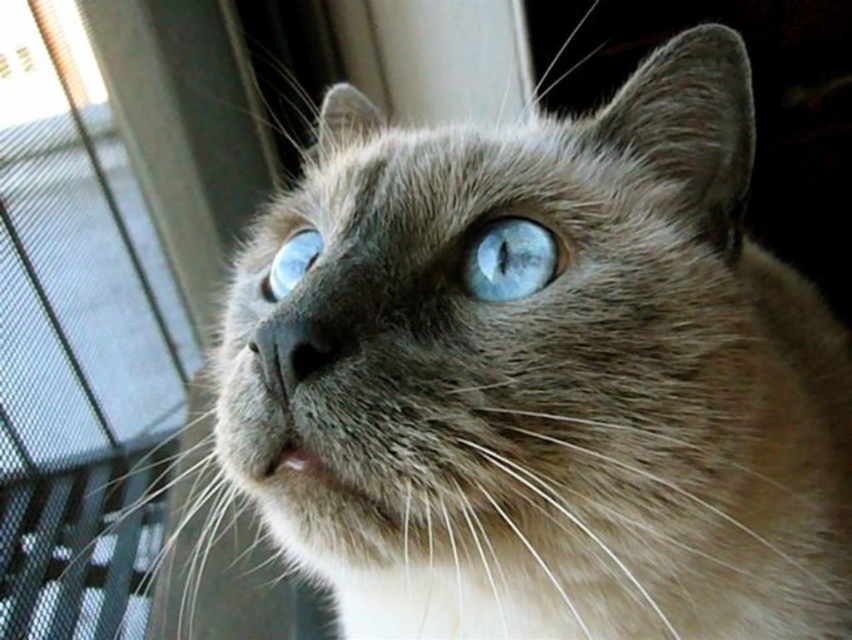
Question: Is transparent glass door at left to the left of blue glossy eye at center from the viewer's perspective?

Choices:
 (A) yes
 (B) no

Answer: (A)

Question: Is blue glossy eye at center below blue glossy eye at upper center?

Choices:
 (A) yes
 (B) no

Answer: (A)

Question: Which point is farther from the camera taking this photo?

Choices:
 (A) (73, 420)
 (B) (292, 244)
 (C) (532, 243)

Answer: (A)

Question: Which of the following is the closest to the observer?

Choices:
 (A) transparent glass door at left
 (B) blue glossy eye at upper center
 (C) blue glossy eye at center

Answer: (C)

Question: Is transparent glass door at left below blue glossy eye at center?

Choices:
 (A) yes
 (B) no

Answer: (A)

Question: Which object appears closest to the camera in this image?

Choices:
 (A) blue glossy eye at center
 (B) blue glossy eye at upper center

Answer: (A)